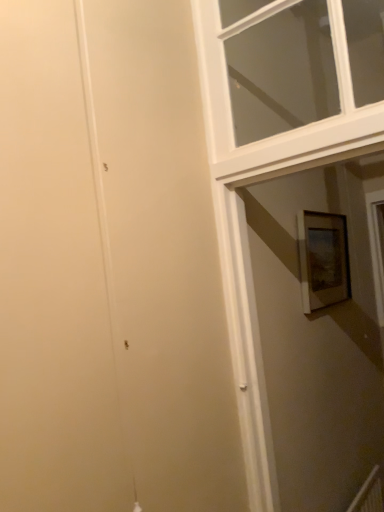
Question: From a real-world perspective, is wooden framed picture at right physically located above or below white wooden window at upper right?

Choices:
 (A) above
 (B) below

Answer: (B)

Question: Is wooden framed picture at right situated inside white wooden window at upper right or outside?

Choices:
 (A) outside
 (B) inside

Answer: (A)

Question: Considering the positions of wooden framed picture at right and white wooden window at upper right in the image, is wooden framed picture at right wider or thinner than white wooden window at upper right?

Choices:
 (A) wide
 (B) thin

Answer: (B)

Question: Relative to wooden framed picture at right, is white wooden window at upper right in front or behind?

Choices:
 (A) behind
 (B) front

Answer: (B)

Question: Considering the positions of white wooden window at upper right and wooden framed picture at right in the image, is white wooden window at upper right taller or shorter than wooden framed picture at right?

Choices:
 (A) short
 (B) tall

Answer: (B)

Question: Is white wooden window at upper right inside or outside of wooden framed picture at right?

Choices:
 (A) inside
 (B) outside

Answer: (B)

Question: Considering the positions of white wooden window at upper right and wooden framed picture at right in the image, is white wooden window at upper right wider or thinner than wooden framed picture at right?

Choices:
 (A) thin
 (B) wide

Answer: (B)